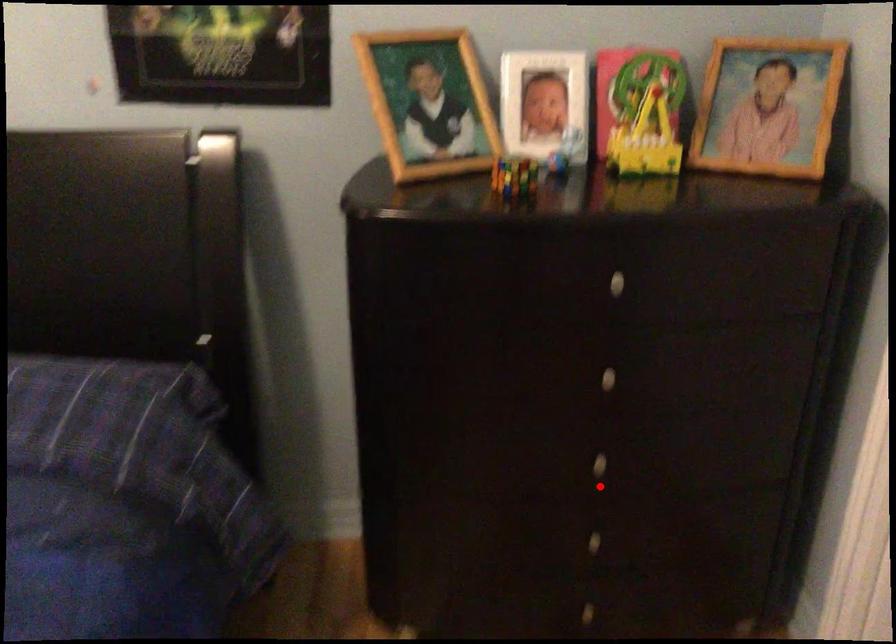
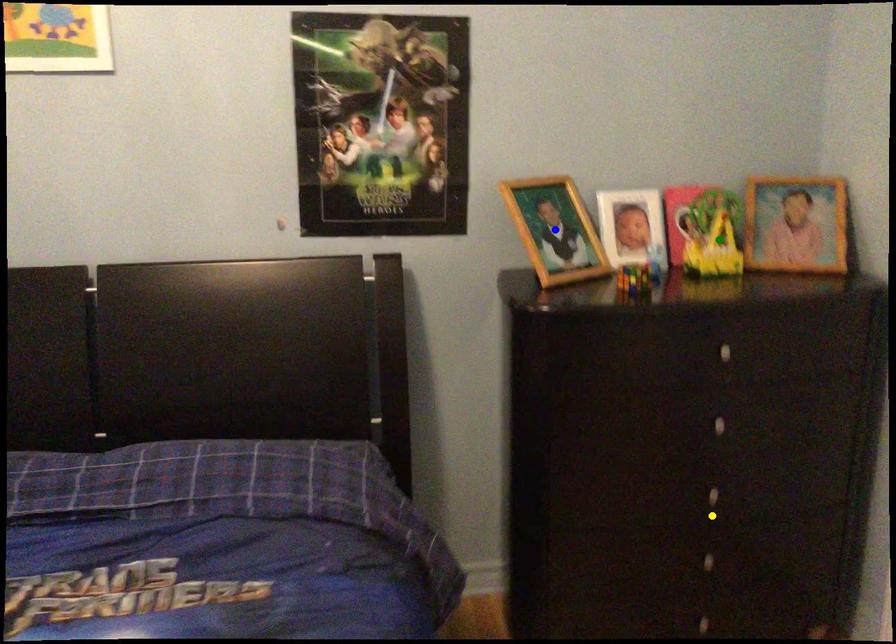
Question: I am providing you with two images of the same scene from different viewpoints. A red point is marked on the first image. You are given multiple points on the second image. Which spot in image 2 lines up with the point in image 1?

Choices:
 (A) blue point
 (B) green point
 (C) yellow point

Answer: (C)